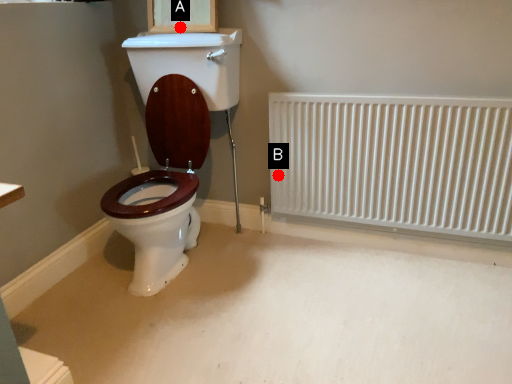
Question: Two points are circled on the image, labeled by A and B beside each circle. Among these points, which one is nearest to the camera?

Choices:
 (A) A is closer
 (B) B is closer

Answer: (A)